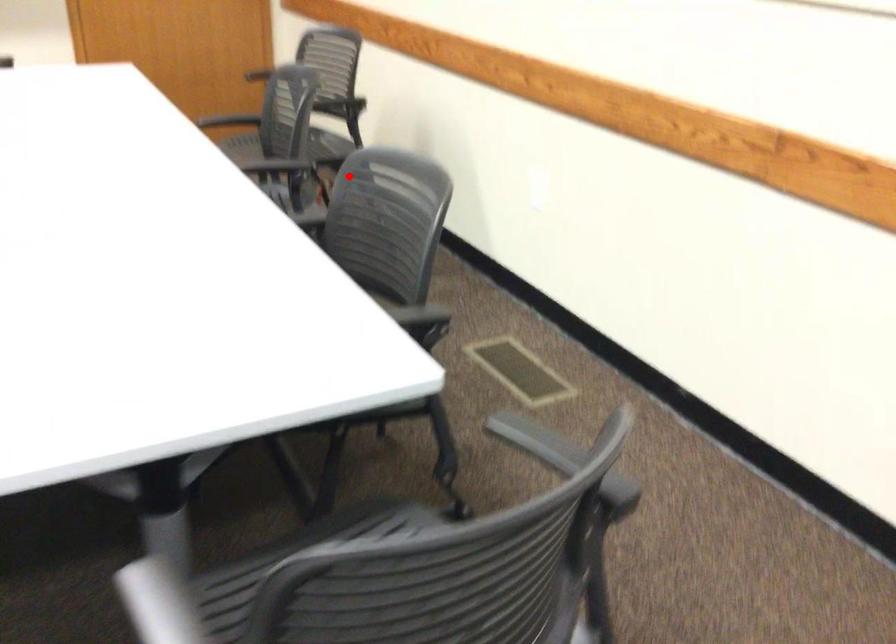
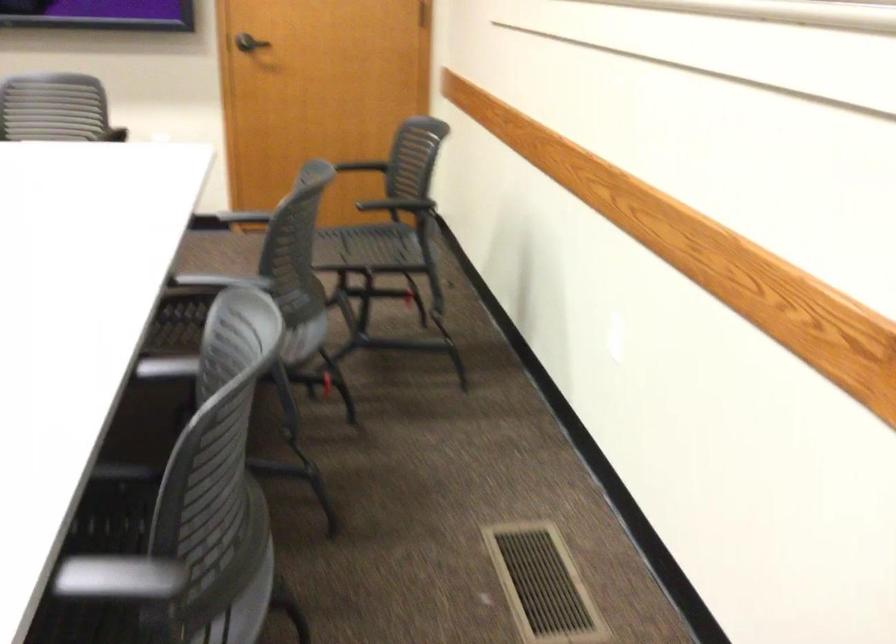
Question: I am providing you with two images of the same scene from different viewpoints. A red point is shown in image1. For the corresponding object point in image2, is it positioned nearer or farther from the camera?

Choices:
 (A) Nearer
 (B) Farther

Answer: (A)